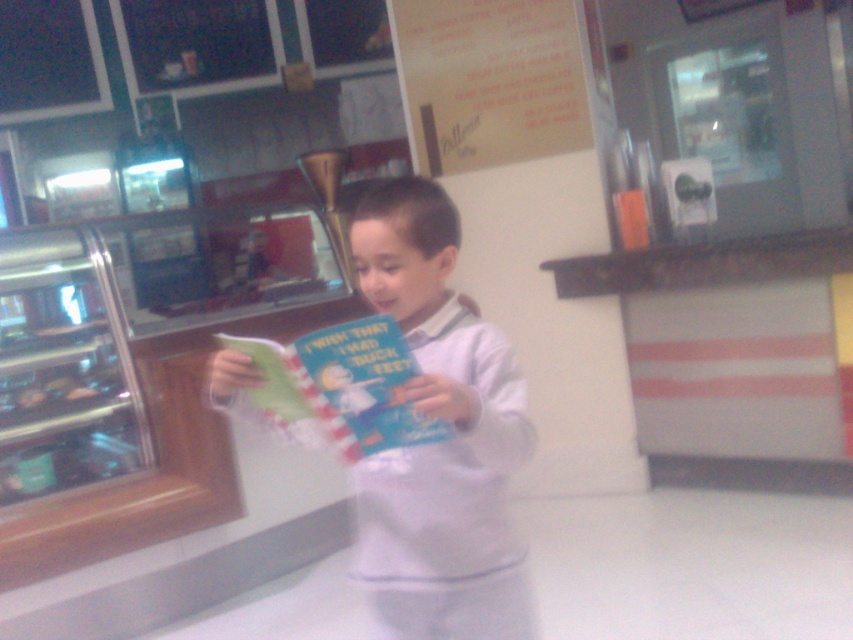
Who is positioned more to the right, white matte shirt at center or green paper book at center?

Positioned to the right is white matte shirt at center.

Is point (447, 314) closer to viewer compared to point (318, 417)?

No, it is behind (318, 417).

Describe the element at coordinates (439, 442) in the screenshot. This screenshot has height=640, width=853. I see `white matte shirt at center` at that location.

I want to click on white matte shirt at center, so click(439, 442).

Who is higher up, wooden signboard at upper center or green paper book at center?

Positioned higher is wooden signboard at upper center.

Measure the distance between point (395, 35) and camera.

They are 3.57 meters apart.

Is point (518, 40) closer to camera compared to point (370, 397)?

No, (518, 40) is behind (370, 397).

Find the location of a particular element. The image size is (853, 640). wooden signboard at upper center is located at coordinates (489, 81).

Does white matte shirt at center have a larger size compared to wooden signboard at upper center?

Actually, white matte shirt at center might be smaller than wooden signboard at upper center.

Is white matte shirt at center to the right of wooden signboard at upper center from the viewer's perspective?

In fact, white matte shirt at center is to the left of wooden signboard at upper center.

I want to click on white matte shirt at center, so click(439, 442).